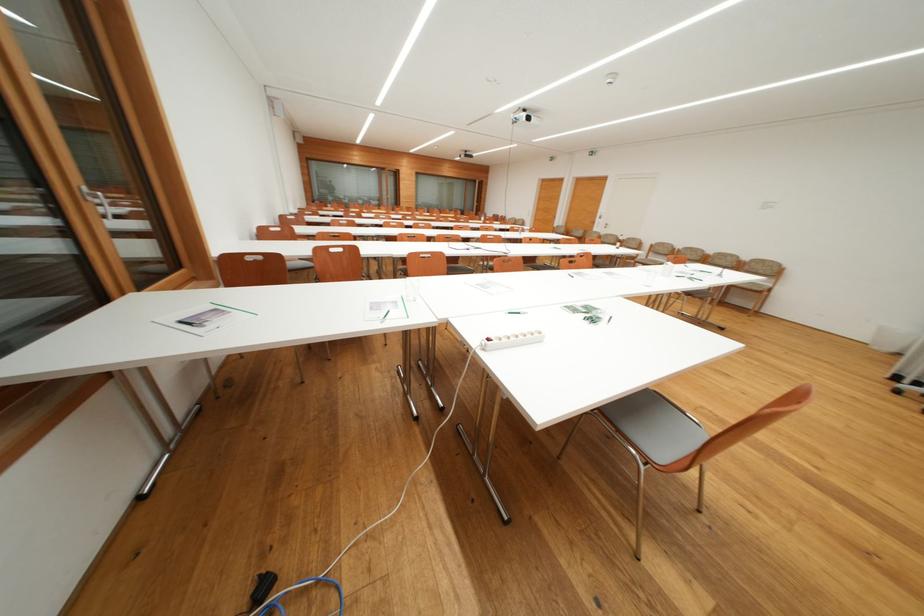
Where is `chair sitting surface`? The image size is (924, 616). chair sitting surface is located at coordinates tap(663, 429).